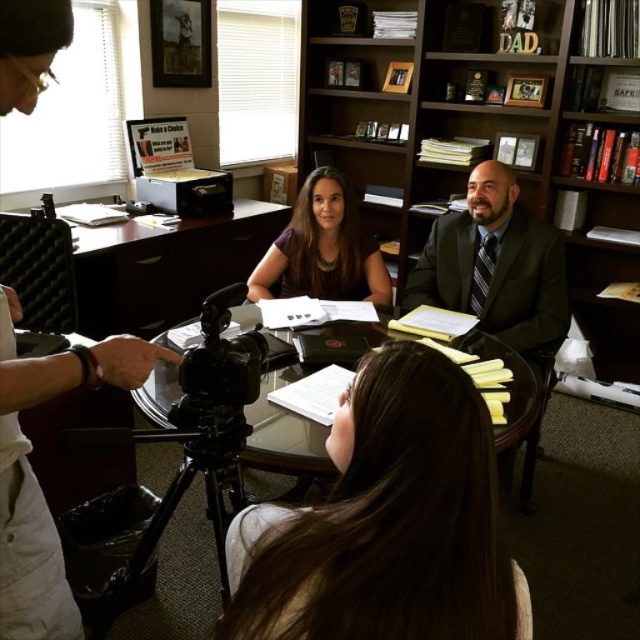
You are organizing the items in the office. You need to place the white plastic camera at left on the transparent glass table at center. Is the camera currently positioned in front of or behind the table?

The white plastic camera at left is in front of the transparent glass table at center, so it is positioned in front of the table.

You are organizing a meeting in the office and need to place a large whiteboard on the right side of the transparent glass table at center. Is there enough space to place it there considering the wooden bookshelf at upper center?

The wooden bookshelf at upper center is positioned on the right side of transparent glass table at center, so placing a large whiteboard on the right side of the transparent glass table at center may not be possible due to the existing presence of the wooden bookshelf at upper center.

You are standing at the entrance of the office and want to take a photo of the documents on the round glass table. The white plastic camera at left is on the desk. Is the camera within your reach without moving any furniture?

The white plastic camera at left is located at point [35,477], which is on the desk. Since the desk is near the wall opposite the entrance, you would need to move around the room to reach it, so it might not be within immediate reach without moving any furniture.